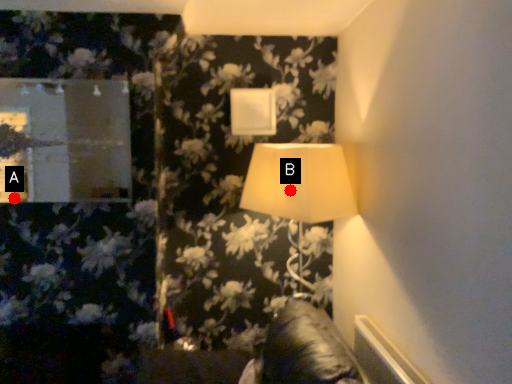
Question: Two points are circled on the image, labeled by A and B beside each circle. Which point appears farthest from the camera in this image?

Choices:
 (A) A is further
 (B) B is further

Answer: (A)